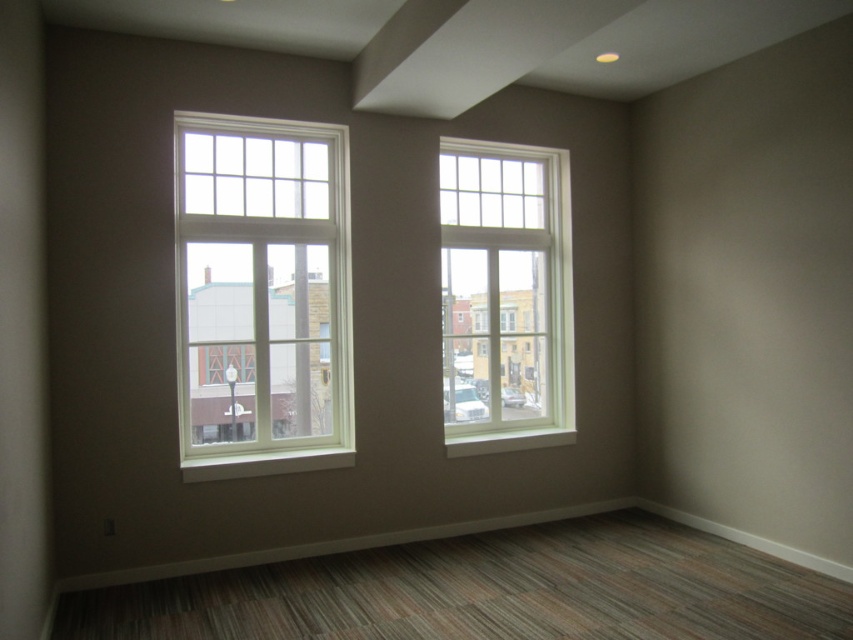
Question: Is the position of white wood window at left more distant than that of white wood window at center?

Choices:
 (A) yes
 (B) no

Answer: (B)

Question: Is white wood window at left to the right of white wood window at center from the viewer's perspective?

Choices:
 (A) no
 (B) yes

Answer: (A)

Question: Which point is closer to the camera?

Choices:
 (A) (459, 433)
 (B) (225, 202)

Answer: (B)

Question: Which of the following is the farthest from the observer?

Choices:
 (A) white wood window at center
 (B) white wood window at left

Answer: (A)

Question: Does white wood window at left have a larger size compared to white wood window at center?

Choices:
 (A) yes
 (B) no

Answer: (B)